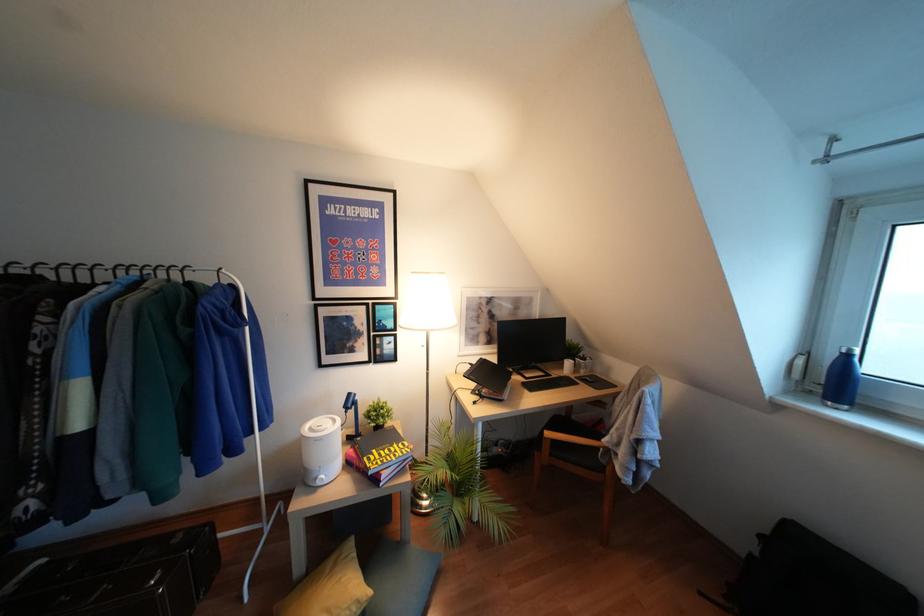
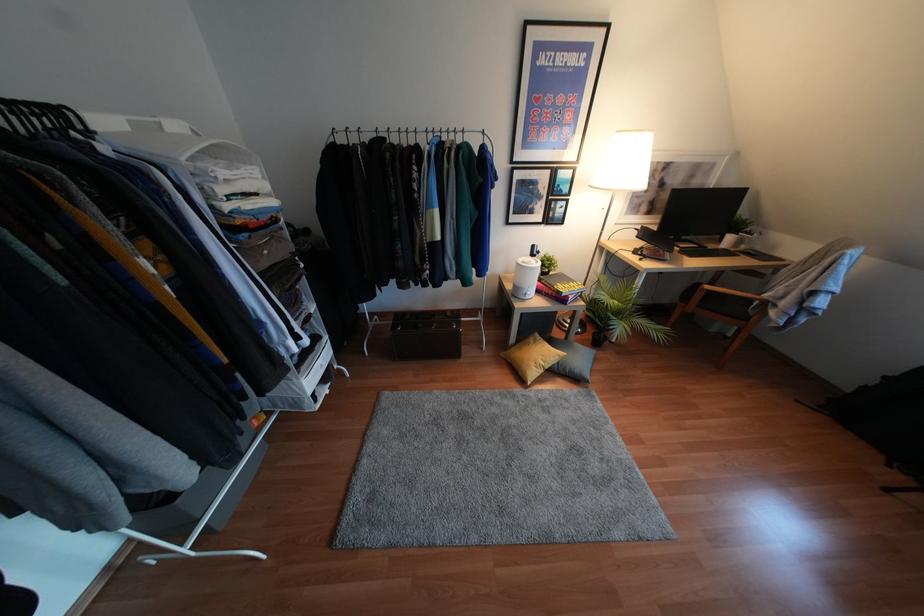
In the second image, find the point that corresponds to pixel 602 468 in the first image.

(745, 318)